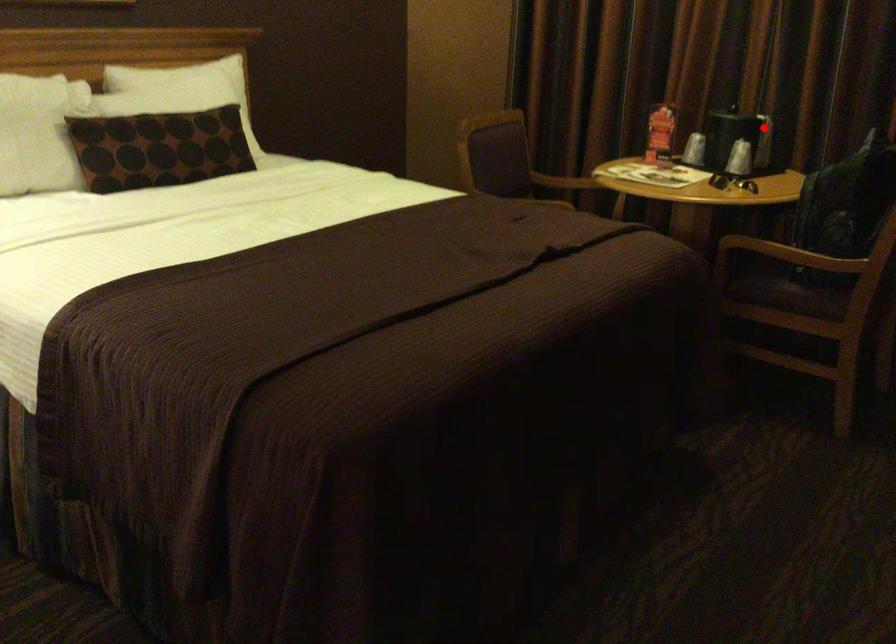
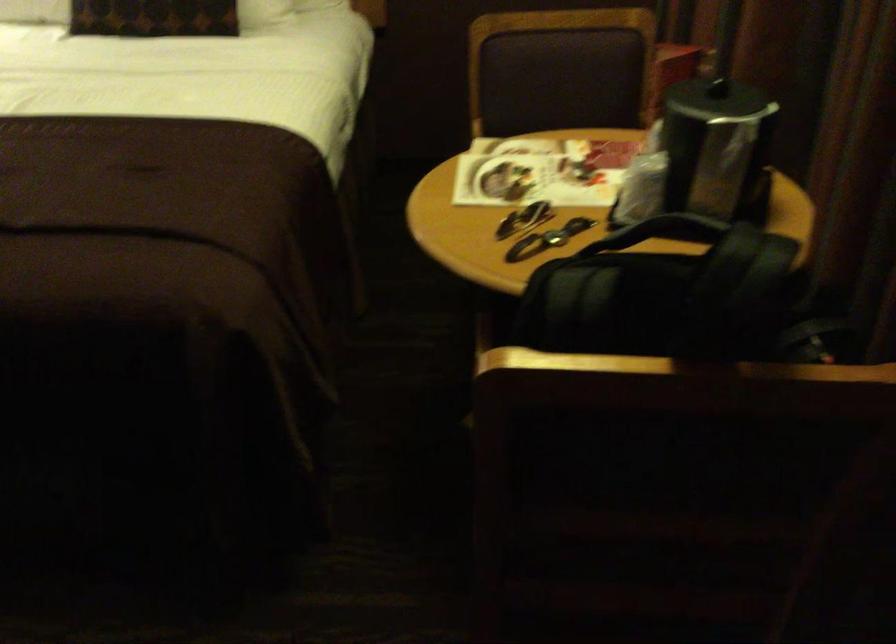
Question: A red point is marked in image1. In image2, is the corresponding 3D point closer to the camera or farther? Reply with the corresponding letter.

Choices:
 (A) The corresponding 3D point is closer.
 (B) The corresponding 3D point is farther.

Answer: (A)